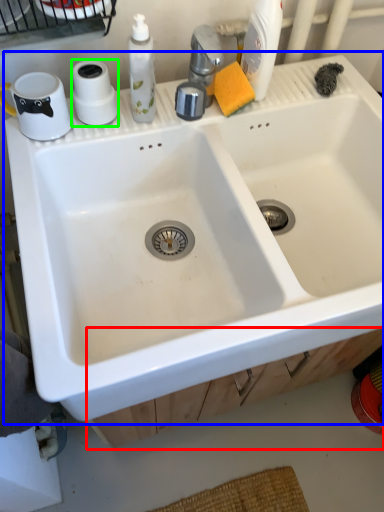
Question: Which object is the farthest from drawer (highlighted by a red box)? Choose among these: sink (highlighted by a blue box) or toilet paper (highlighted by a green box).

Choices:
 (A) sink
 (B) toilet paper

Answer: (B)